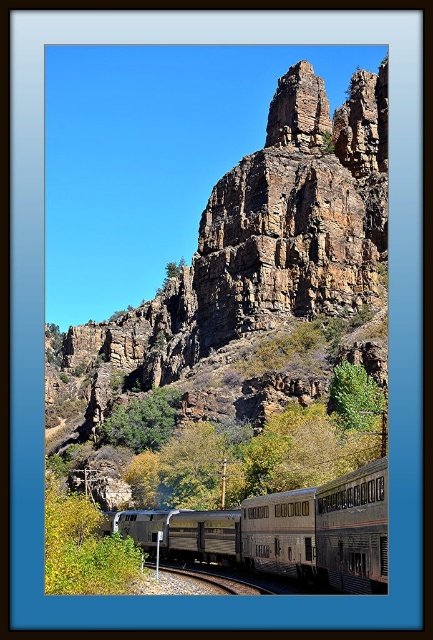
You are a train engineer driving the silver metallic train at center. You notice a rugged brown rock formation at center ahead on the tracks. Can you safely stop before reaching the rock formation if your train requires 110 feet to stop?

The rugged brown rock formation at center and silver metallic train at center are 112.82 feet apart. Since the stopping distance required is 110 feet, the train can safely stop before reaching the rugged brown rock formation at center.